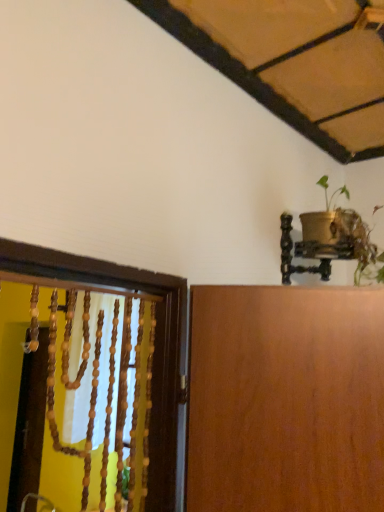
What do you see at coordinates (340, 237) in the screenshot? I see `matte gold pot at upper right` at bounding box center [340, 237].

What is the approximate height of matte gold pot at upper right?

The height of matte gold pot at upper right is 13.77 inches.

The image size is (384, 512). I want to click on matte gold pot at upper right, so click(340, 237).

What is the approximate width of matte gold pot at upper right?

It is 15.98 inches.

The width and height of the screenshot is (384, 512). I want to click on matte gold pot at upper right, so click(x=340, y=237).